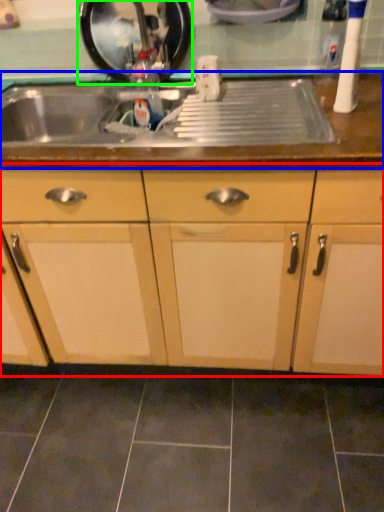
Question: Which object is the farthest from cabinetry (highlighted by a red box)? Choose among these: countertop (highlighted by a blue box) or appliance (highlighted by a green box).

Choices:
 (A) countertop
 (B) appliance

Answer: (B)